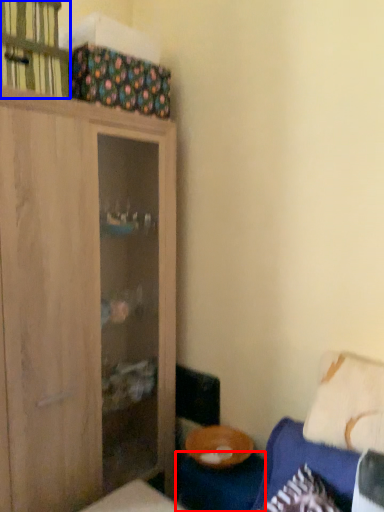
Question: Which object appears farthest to the camera in this image, table (highlighted by a red box) or cabinet (highlighted by a blue box)?

Choices:
 (A) table
 (B) cabinet

Answer: (A)